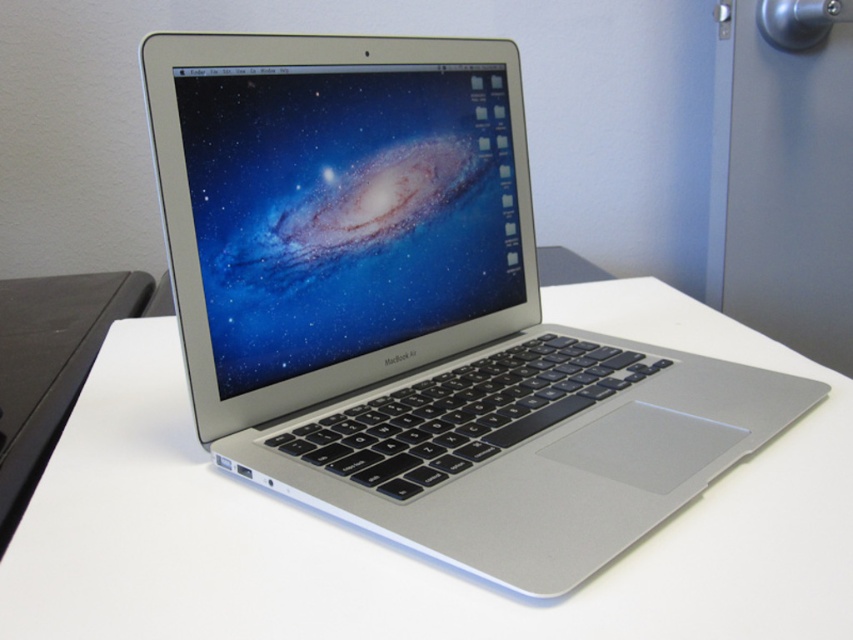
Who is more forward, [215,385] or [735,336]?

Point [215,385] is more forward.

Does silver metallic laptop at center have a larger size compared to white matte table at center?

No, silver metallic laptop at center is not bigger than white matte table at center.

Between point (318, 145) and point (548, 625), which one is positioned in front?

Point (548, 625) is in front.

Identify the location of silver metallic laptop at center. (415, 310).